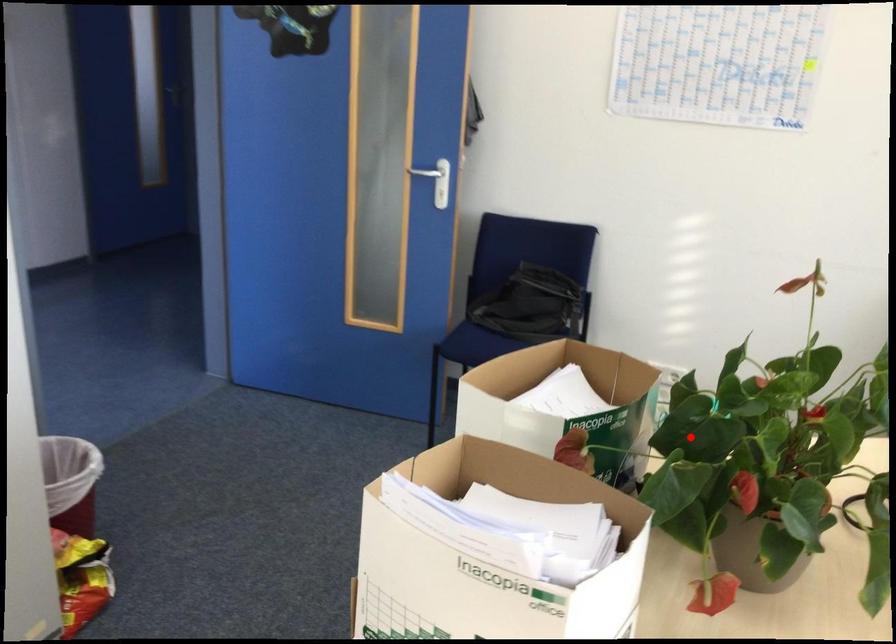
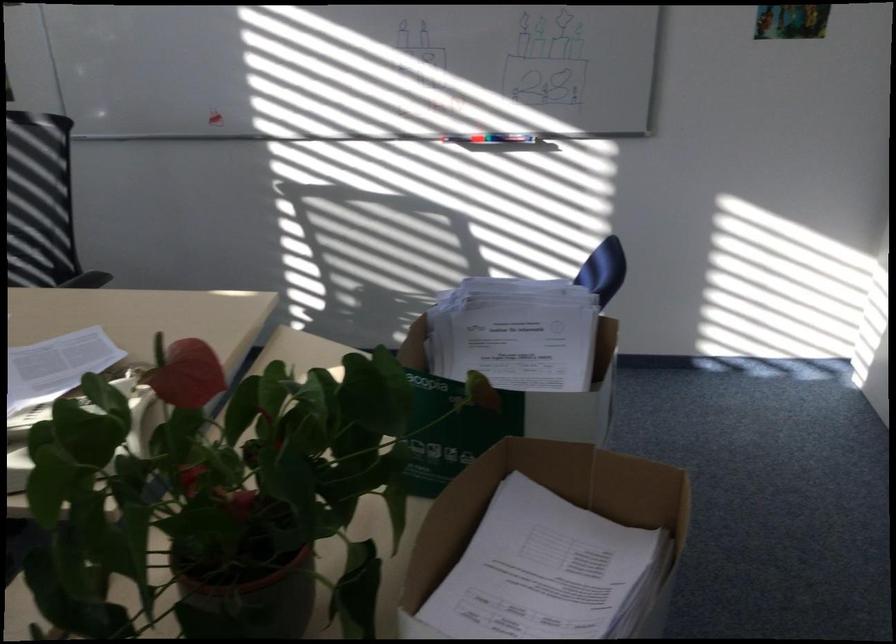
Find the pixel in the second image that matches the highlighted location in the first image.

(262, 597)